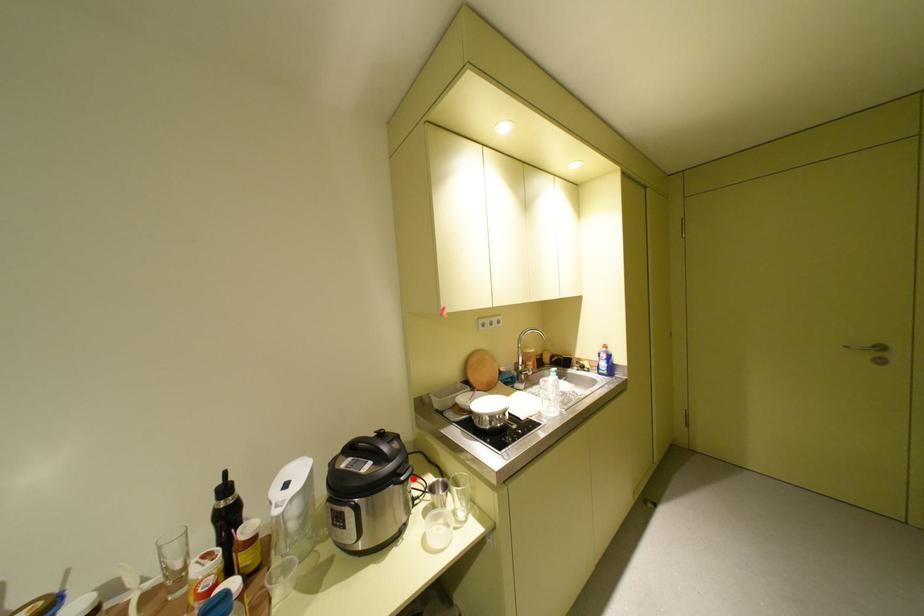
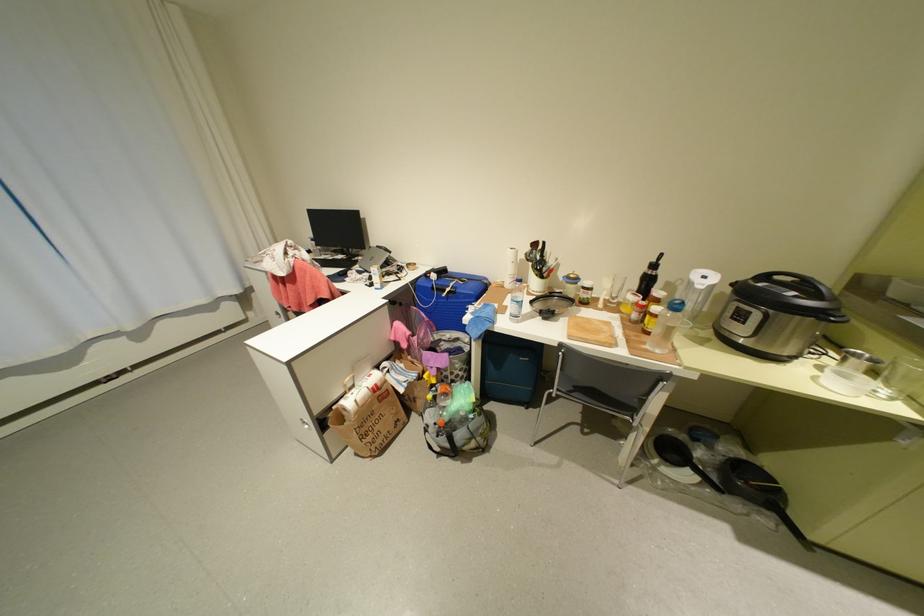
Question: I am providing you with two images of the same scene from different viewpoints. Given a red point in image1, look at the same physical point in image2. Is it:

Choices:
 (A) Closer to the viewpoint
 (B) Farther from the viewpoint

Answer: (B)